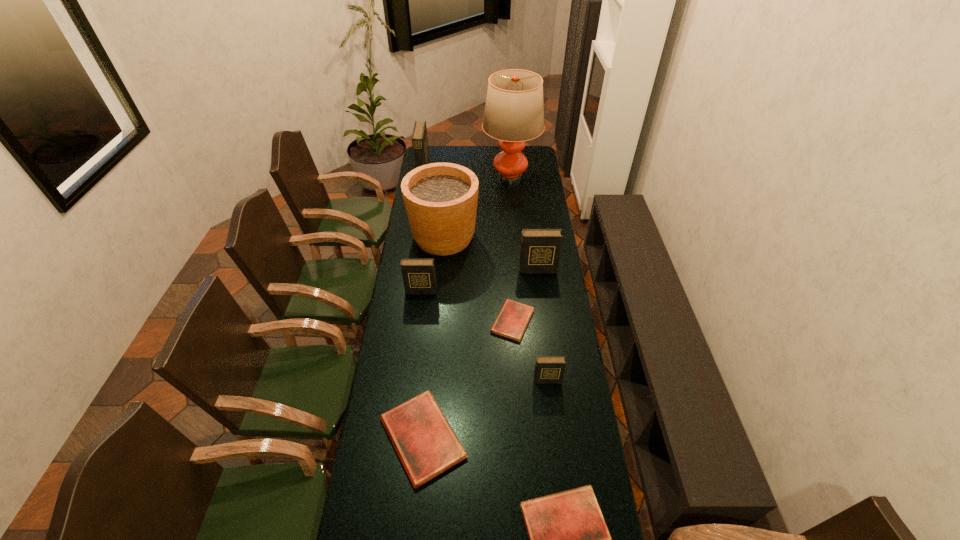
Image resolution: width=960 pixels, height=540 pixels. Find the location of `free space located on the front cover of the fifth farthest diary`. free space located on the front cover of the fifth farthest diary is located at coordinates (556, 451).

Where is `vacant area situated 0.340m on the right of the biggest red diary`? This screenshot has width=960, height=540. vacant area situated 0.340m on the right of the biggest red diary is located at coordinates (570, 438).

The image size is (960, 540). Identify the location of free space located on the front of the shortest diary. (515, 355).

The height and width of the screenshot is (540, 960). Identify the location of lamp located in the far edge section of the desktop. (514, 112).

At what (x,y) coordinates should I click in order to perform the action: click on diary that is at the far edge. Please return your answer as a coordinate pair (x, y). Looking at the image, I should click on (419, 137).

The width and height of the screenshot is (960, 540). Identify the location of flowerpot that is positioned at the left edge. (440, 199).

This screenshot has width=960, height=540. Find the location of `lamp located in the right edge section of the desktop`. lamp located in the right edge section of the desktop is located at coordinates (514, 112).

In order to click on object at the far left corner in this screenshot , I will do `click(419, 137)`.

At what (x,y) coordinates should I click in order to perform the action: click on object at the far right corner. Please return your answer as a coordinate pair (x, y). Looking at the image, I should click on (514, 112).

In the image, there is a desktop. Identify the location of vacant space at the left edge. This screenshot has width=960, height=540. (401, 255).